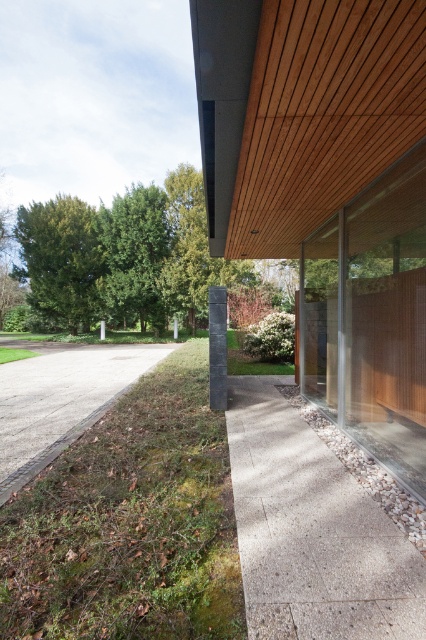
Question: Is concrete textured driveway at lower right further to camera compared to gravel driveway at lower left?

Choices:
 (A) no
 (B) yes

Answer: (A)

Question: Among these objects, which one is farthest from the camera?

Choices:
 (A) gravel driveway at lower left
 (B) concrete textured driveway at lower right

Answer: (A)

Question: Which of the following is the farthest from the observer?

Choices:
 (A) click(x=230, y=417)
 (B) click(x=86, y=358)

Answer: (B)

Question: Is concrete textured driveway at lower right to the right of gravel driveway at lower left from the viewer's perspective?

Choices:
 (A) yes
 (B) no

Answer: (A)

Question: Can you confirm if concrete textured driveway at lower right is thinner than gravel driveway at lower left?

Choices:
 (A) no
 (B) yes

Answer: (B)